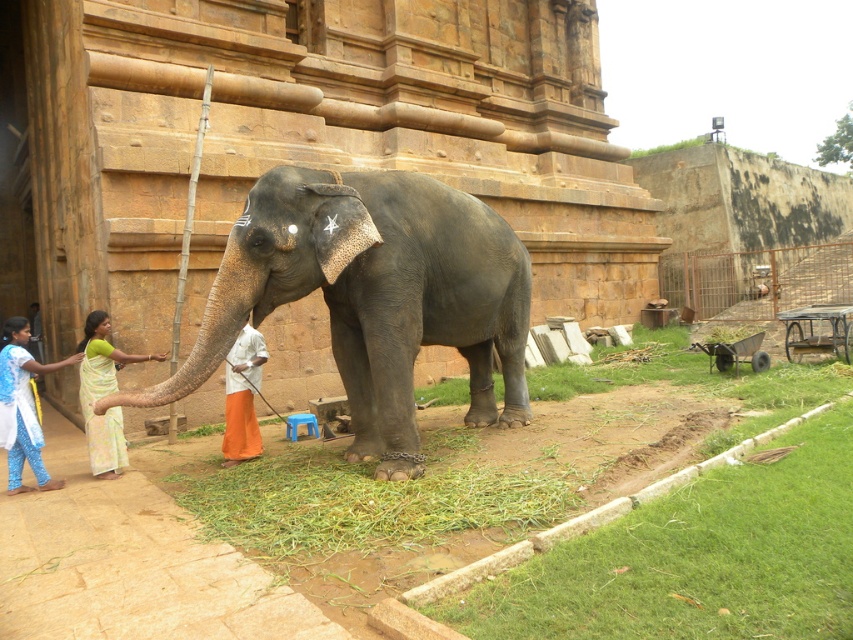
Between point (209, 333) and point (338, 525), which one is positioned in front?

Point (338, 525)

Does gray textured elephant at center have a lesser height compared to green grass at lower center?

No.

You are a GUI agent. You are given a task and a screenshot of the screen. Output one action in this format:
    pyautogui.click(x=<x>, y=<y>)
    Task: Click on the gray textured elephant at center
    
    Given the screenshot: What is the action you would take?
    pyautogui.click(x=373, y=296)

Is gray textured elephant at center taller than orange cloth at center?

Yes.

Is gray textured elephant at center above orange cloth at center?

Yes, gray textured elephant at center is above orange cloth at center.

Is point (361, 216) closer to viewer compared to point (248, 346)?

Yes, it is in front of point (248, 346).

The height and width of the screenshot is (640, 853). What are the coordinates of `gray textured elephant at center` in the screenshot? It's located at (373, 296).

Who is more forward, (254, 472) or (259, 451)?

Positioned in front is point (254, 472).

Between green grass at lower center and orange cloth at center, which one has more height?

orange cloth at center

Is point (271, 476) farther from camera compared to point (244, 440)?

No, (271, 476) is closer to viewer.

Image resolution: width=853 pixels, height=640 pixels. I want to click on green grass at lower center, so click(x=361, y=500).